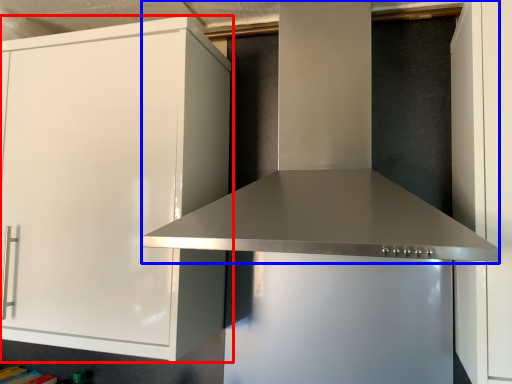
Question: Which object is closer to the camera taking this photo, cabinetry (highlighted by a red box) or vent (highlighted by a blue box)?

Choices:
 (A) cabinetry
 (B) vent

Answer: (B)